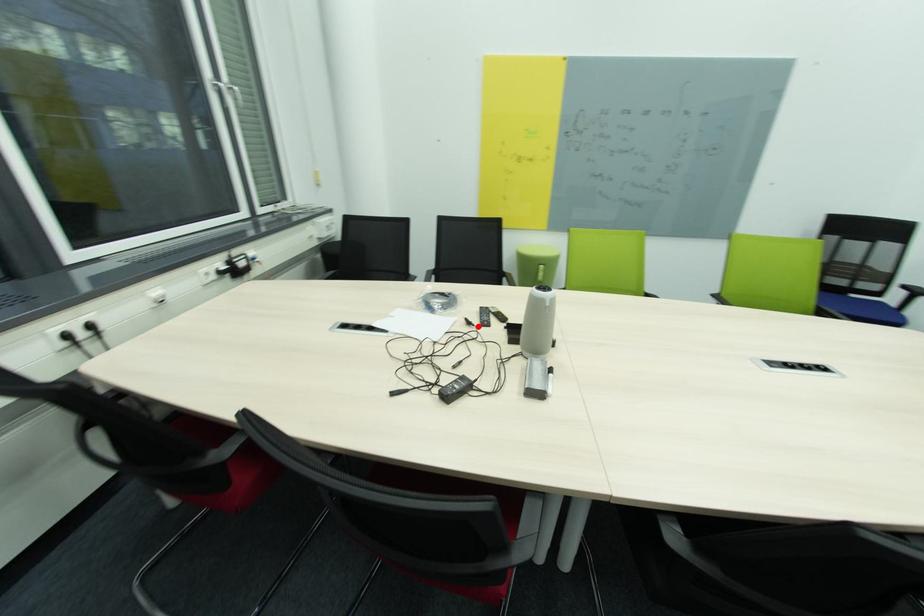
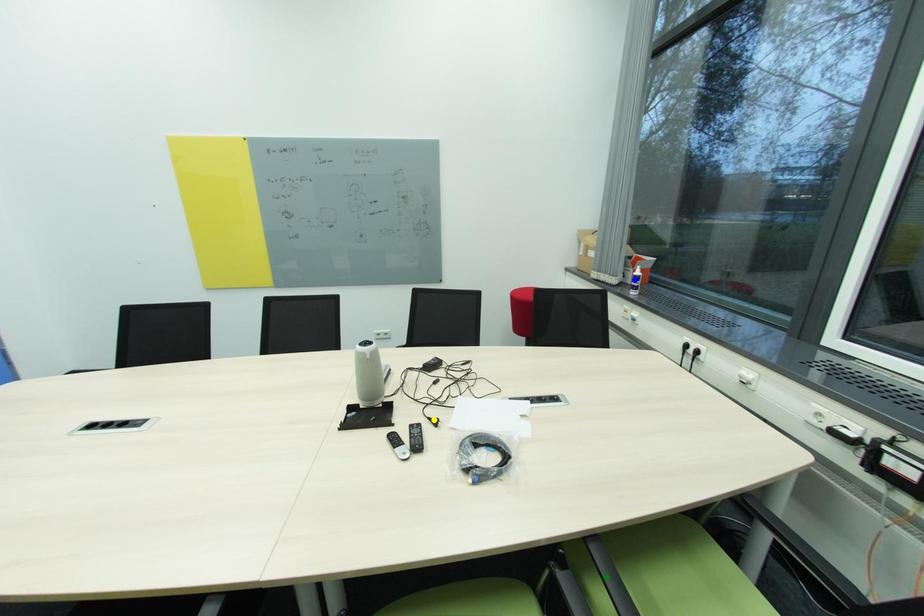
Question: I am providing you with two images of the same scene from different viewpoints. A red point is marked on the first image. You are given multiple points on the second image. Which mark in image 2 goes with the point in image 1?

Choices:
 (A) yellow point
 (B) blue point
 (C) green point

Answer: (A)